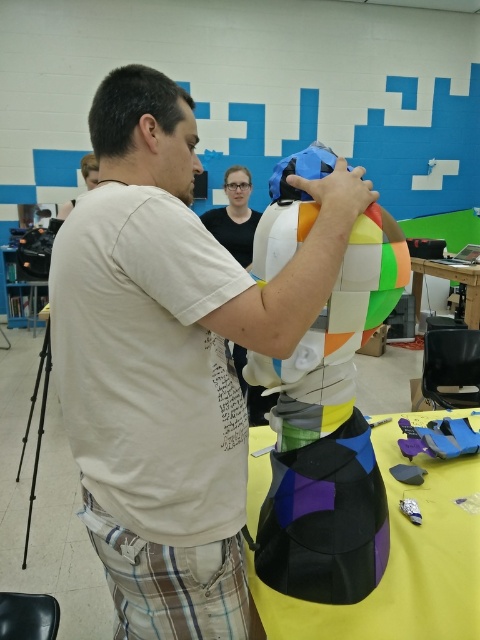
Question: Is multicolored paper mache mask at center in front of black fabric table at center?

Choices:
 (A) no
 (B) yes

Answer: (B)

Question: Among these objects, which one is nearest to the camera?

Choices:
 (A) black fabric table at center
 (B) multicolored paper mache mask at center
 (C) matte white shirt at center
 (D) yellow matte table at lower right

Answer: (C)

Question: Does matte white shirt at center come behind yellow matte table at lower right?

Choices:
 (A) yes
 (B) no

Answer: (B)

Question: Considering the real-world distances, which object is farthest from the multicolored paper mache mask at center?

Choices:
 (A) black fabric table at center
 (B) yellow matte table at lower right
 (C) matte white shirt at center

Answer: (B)

Question: Which object is the closest to the yellow matte table at lower right?

Choices:
 (A) black fabric table at center
 (B) multicolored paper mache mask at center
 (C) matte white shirt at center

Answer: (A)

Question: Does multicolored paper mache mask at center appear on the left side of black fabric table at center?

Choices:
 (A) yes
 (B) no

Answer: (A)